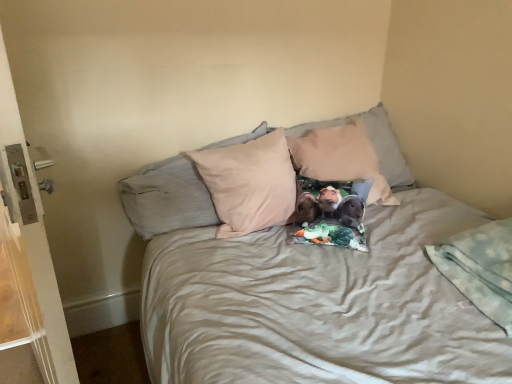
Image resolution: width=512 pixels, height=384 pixels. I want to click on beige fabric pillow at center, which appears as the second pillow when viewed from the right, so 167,198.

Measure the distance between point (506, 324) and camera.

3.58 feet.

What is the approximate width of beige fabric pillow at center, the 2th pillow from the left?

23.03 inches.

You are a GUI agent. You are given a task and a screenshot of the screen. Output one action in this format:
    pyautogui.click(x=<x>, y=<y>)
    Task: Click on the beige fabric pillow at center, which appears as the second pillow when viewed from the right
    
    Given the screenshot: What is the action you would take?
    pyautogui.click(x=167, y=198)

From the image's perspective, is light blue fleece blanket at lower right over white plastic screen door at left?

Actually, light blue fleece blanket at lower right appears below white plastic screen door at left in the image.

Which is more distant, (440, 270) or (52, 289)?

Point (440, 270)

Is light blue fleece blanket at lower right facing towards white plastic screen door at left?

No, light blue fleece blanket at lower right is not facing towards white plastic screen door at left.

Between light blue fleece blanket at lower right and white plastic screen door at left, which one has less height?

light blue fleece blanket at lower right is shorter.

Would you say beige fabric pillow at center, which appears as the second pillow when viewed from the right, is to the left or to the right of beige fabric pillow at center, the first pillow when ordered from right to left, in the picture?

Based on their positions, beige fabric pillow at center, which appears as the second pillow when viewed from the right, is located to the left of beige fabric pillow at center, the first pillow when ordered from right to left.

Is point (128, 209) positioned before point (393, 168)?

That is True.

From the image's perspective, who appears lower, beige fabric pillow at center, which appears as the second pillow when viewed from the right, or beige fabric pillow at center, the first pillow when ordered from right to left?

beige fabric pillow at center, which appears as the second pillow when viewed from the right, is shown below in the image.

Is beige fabric pillow at center, which appears as the second pillow when viewed from the right, in front of or behind beige fabric pillow at center, the 2th pillow from the left, in the image?

beige fabric pillow at center, which appears as the second pillow when viewed from the right, is in front of beige fabric pillow at center, the 2th pillow from the left.

Can you confirm if beige fabric pillow at center, positioned as the first pillow in left-to-right order, is taller than light blue fleece blanket at lower right?

Yes, beige fabric pillow at center, positioned as the first pillow in left-to-right order, is taller than light blue fleece blanket at lower right.

Is beige fabric pillow at center, which appears as the second pillow when viewed from the right, positioned with its back to light blue fleece blanket at lower right?

No, beige fabric pillow at center, which appears as the second pillow when viewed from the right, is not facing the opposite direction of light blue fleece blanket at lower right.

Consider the image. Is beige fabric pillow at center, positioned as the first pillow in left-to-right order, located outside light blue fleece blanket at lower right?

That's correct, beige fabric pillow at center, positioned as the first pillow in left-to-right order, is outside of light blue fleece blanket at lower right.

Which of these two, beige fabric pillow at center, positioned as the first pillow in left-to-right order, or light blue fleece blanket at lower right, is smaller?

Smaller between the two is light blue fleece blanket at lower right.

How many degrees apart are the facing directions of beige fabric pillow at center, the 2th pillow from the left, and beige fabric pillow at center, positioned as the first pillow in left-to-right order?

The angular difference between beige fabric pillow at center, the 2th pillow from the left, and beige fabric pillow at center, positioned as the first pillow in left-to-right order, is 0.642 degrees.

Is beige fabric pillow at center, the first pillow when ordered from right to left, inside the boundaries of beige fabric pillow at center, positioned as the first pillow in left-to-right order, or outside?

beige fabric pillow at center, the first pillow when ordered from right to left, is not enclosed by beige fabric pillow at center, positioned as the first pillow in left-to-right order.

Which is nearer, (333, 124) or (187, 175)?

Clearly, point (333, 124) is more distant from the camera than point (187, 175).

Is beige fabric pillow at center, the 2th pillow from the left, wider or thinner than beige fabric pillow at center, positioned as the first pillow in left-to-right order?

Clearly, beige fabric pillow at center, the 2th pillow from the left, has less width compared to beige fabric pillow at center, positioned as the first pillow in left-to-right order.

Which is more to the left, beige fabric pillow at center, positioned as the first pillow in left-to-right order, or white plastic screen door at left?

white plastic screen door at left is more to the left.

Between point (157, 171) and point (5, 149), which one is positioned in front?

The point (5, 149) is closer to the camera.

Are beige fabric pillow at center, which appears as the second pillow when viewed from the right, and white plastic screen door at left located far from each other?

No, beige fabric pillow at center, which appears as the second pillow when viewed from the right, is not far from white plastic screen door at left.

From the image's perspective, would you say white plastic screen door at left is shown under beige fabric pillow at center, positioned as the first pillow in left-to-right order?

Yes, from the image's perspective, white plastic screen door at left is beneath beige fabric pillow at center, positioned as the first pillow in left-to-right order.

In order to click on screen door in front of the beige fabric pillow at center, which appears as the second pillow when viewed from the right in this screenshot , I will do `click(32, 243)`.

In the image, is white plastic screen door at left on the left side or the right side of beige fabric pillow at center, positioned as the first pillow in left-to-right order?

white plastic screen door at left is to the left of beige fabric pillow at center, positioned as the first pillow in left-to-right order.

Between white plastic screen door at left and beige fabric pillow at center, positioned as the first pillow in left-to-right order, which one has smaller size?

→ With smaller size is beige fabric pillow at center, positioned as the first pillow in left-to-right order.

Which object is thinner, beige fabric pillow at center, the first pillow when ordered from right to left, or light blue fleece blanket at lower right?

light blue fleece blanket at lower right is thinner.

Is beige fabric pillow at center, the first pillow when ordered from right to left, facing away from light blue fleece blanket at lower right?

No, beige fabric pillow at center, the first pillow when ordered from right to left, is not facing away from light blue fleece blanket at lower right.

Is beige fabric pillow at center, the 2th pillow from the left, bigger or smaller than light blue fleece blanket at lower right?

Clearly, beige fabric pillow at center, the 2th pillow from the left, is larger in size than light blue fleece blanket at lower right.

From the image's perspective, is beige fabric pillow at center, the 2th pillow from the left, positioned above or below light blue fleece blanket at lower right?

beige fabric pillow at center, the 2th pillow from the left, is above light blue fleece blanket at lower right.

You are a GUI agent. You are given a task and a screenshot of the screen. Output one action in this format:
    pyautogui.click(x=<x>, y=<y>)
    Task: Click on the screen door in front of the light blue fleece blanket at lower right
    This screenshot has width=512, height=384.
    Given the screenshot: What is the action you would take?
    pyautogui.click(x=32, y=243)

You are a GUI agent. You are given a task and a screenshot of the screen. Output one action in this format:
    pyautogui.click(x=<x>, y=<y>)
    Task: Click on the pillow lying on the left of beige fabric pillow at center, the 2th pillow from the left
    Image resolution: width=512 pixels, height=384 pixels.
    Given the screenshot: What is the action you would take?
    pyautogui.click(x=167, y=198)

Estimate the real-world distances between objects in this image. Which object is closer to light blue fleece blanket at lower right, beige fabric pillow at center, the 2th pillow from the left, or white plastic screen door at left?

The object closer to light blue fleece blanket at lower right is beige fabric pillow at center, the 2th pillow from the left.

When comparing their distances from white plastic screen door at left, does beige fabric pillow at center, the first pillow when ordered from right to left, or beige fabric pillow at center, positioned as the first pillow in left-to-right order, seem further?

Based on the image, beige fabric pillow at center, the first pillow when ordered from right to left, appears to be further to white plastic screen door at left.

Based on their spatial positions, is white plastic screen door at left or beige fabric pillow at center, the 2th pillow from the left, closer to beige fabric pillow at center, positioned as the first pillow in left-to-right order?

The object closer to beige fabric pillow at center, positioned as the first pillow in left-to-right order, is beige fabric pillow at center, the 2th pillow from the left.

When comparing their distances from white plastic screen door at left, does light blue fleece blanket at lower right or beige fabric pillow at center, positioned as the first pillow in left-to-right order, seem further?

Based on the image, light blue fleece blanket at lower right appears to be further to white plastic screen door at left.

Considering their positions, is white plastic screen door at left positioned closer to beige fabric pillow at center, which appears as the second pillow when viewed from the right, than light blue fleece blanket at lower right?

white plastic screen door at left.

When comparing their distances from white plastic screen door at left, does beige fabric pillow at center, positioned as the first pillow in left-to-right order, or light blue fleece blanket at lower right seem further?

light blue fleece blanket at lower right is positioned further to the anchor white plastic screen door at left.

When comparing their distances from white plastic screen door at left, does beige fabric pillow at center, which appears as the second pillow when viewed from the right, or beige fabric pillow at center, the first pillow when ordered from right to left, seem further?

beige fabric pillow at center, the first pillow when ordered from right to left, is further to white plastic screen door at left.

When comparing their distances from beige fabric pillow at center, the 2th pillow from the left, does beige fabric pillow at center, positioned as the first pillow in left-to-right order, or white plastic screen door at left seem closer?

beige fabric pillow at center, positioned as the first pillow in left-to-right order.

Identify the location of pillow between beige fabric pillow at center, which appears as the second pillow when viewed from the right, and light blue fleece blanket at lower right from left to right. (371, 143).

Image resolution: width=512 pixels, height=384 pixels. What are the coordinates of `pillow between white plastic screen door at left and beige fabric pillow at center, the first pillow when ordered from right to left` in the screenshot? It's located at (167, 198).